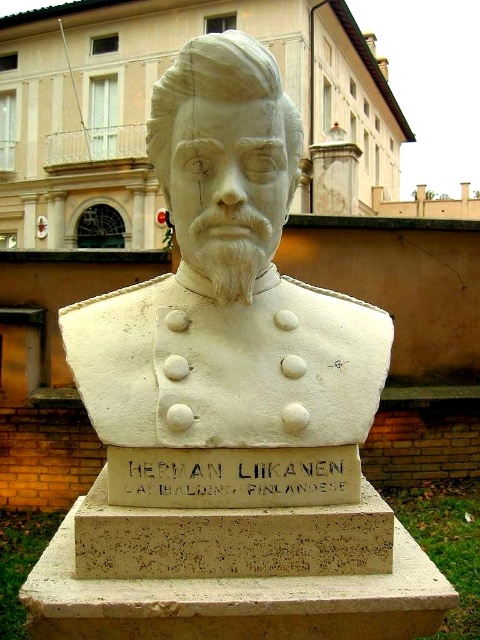
Question: Is white marble bust at center positioned behind gold metallic plaque at center?

Choices:
 (A) yes
 (B) no

Answer: (B)

Question: Is white marble bust at center positioned in front of gold metallic plaque at center?

Choices:
 (A) no
 (B) yes

Answer: (B)

Question: Which point is farther to the camera?

Choices:
 (A) gold metallic plaque at center
 (B) white marble bust at center

Answer: (A)

Question: Does white marble bust at center appear on the left side of gold metallic plaque at center?

Choices:
 (A) no
 (B) yes

Answer: (A)